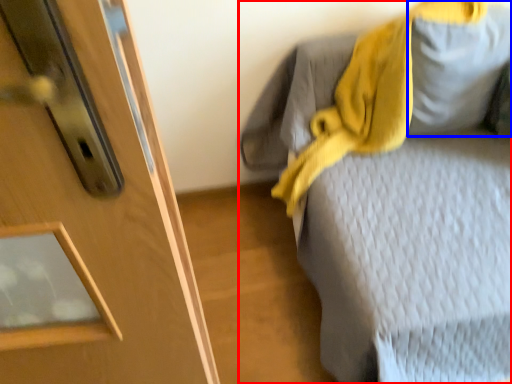
Question: Among these objects, which one is nearest to the camera, furniture (highlighted by a red box) or gray (highlighted by a blue box)?

Choices:
 (A) furniture
 (B) gray

Answer: (A)